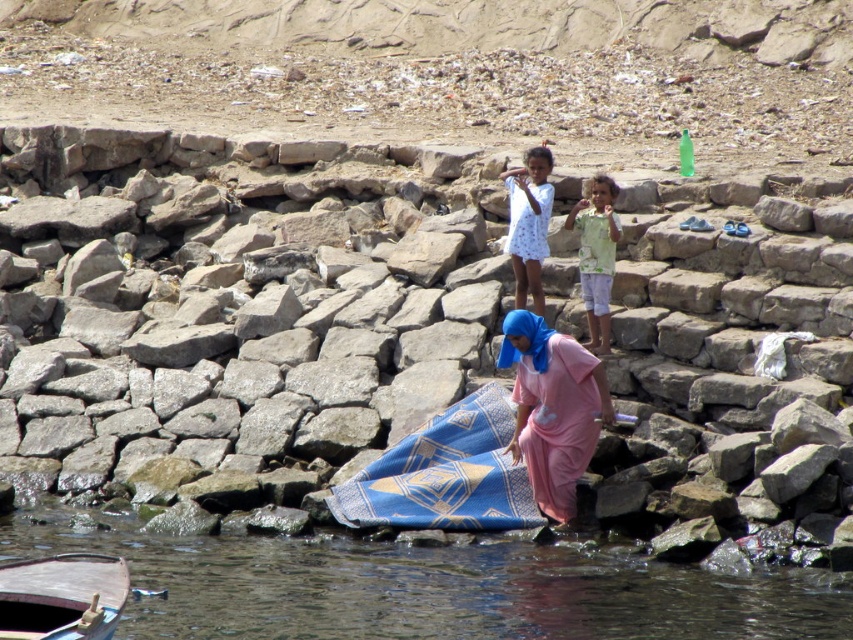
Question: Estimate the real-world distances between objects in this image. Which object is closer to the wooden boat at lower left?

Choices:
 (A) pink fabric at center
 (B) white cotton dress at center
 (C) blue fabric at lower left
 (D) light green fabric at upper center

Answer: (C)

Question: Which point appears closest to the camera in this image?

Choices:
 (A) (604, 234)
 (B) (512, 387)
 (C) (114, 566)
 (D) (434, 440)

Answer: (C)

Question: Is blue fabric at center to the right of wooden boat at lower left from the viewer's perspective?

Choices:
 (A) yes
 (B) no

Answer: (A)

Question: Where is pink fabric at center located in relation to light green fabric at upper center in the image?

Choices:
 (A) below
 (B) above

Answer: (A)

Question: Among these objects, which one is nearest to the camera?

Choices:
 (A) blue woven cloth at lower center
 (B) pink fabric at center
 (C) wooden boat at lower left

Answer: (C)

Question: Does blue fabric at lower left have a larger size compared to light green fabric at upper center?

Choices:
 (A) no
 (B) yes

Answer: (B)